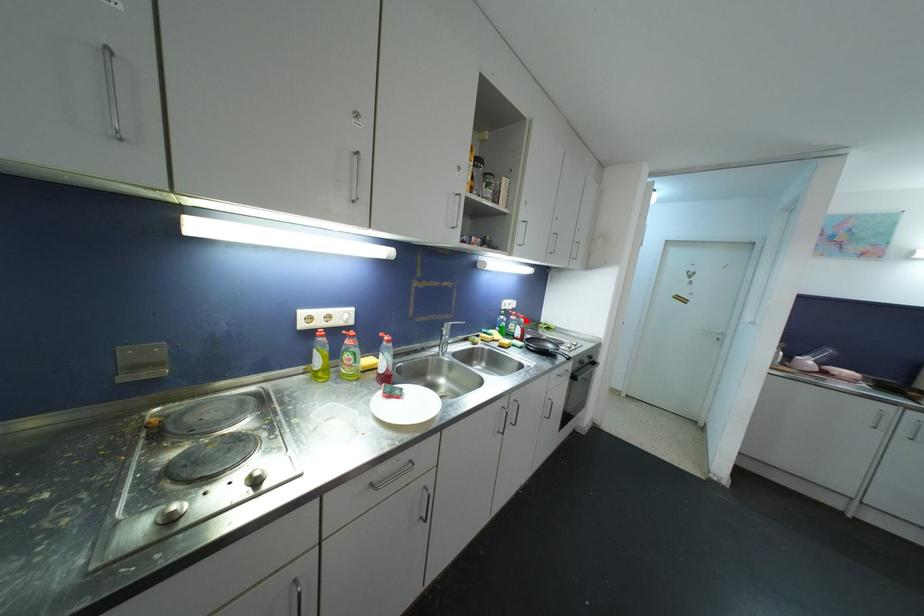
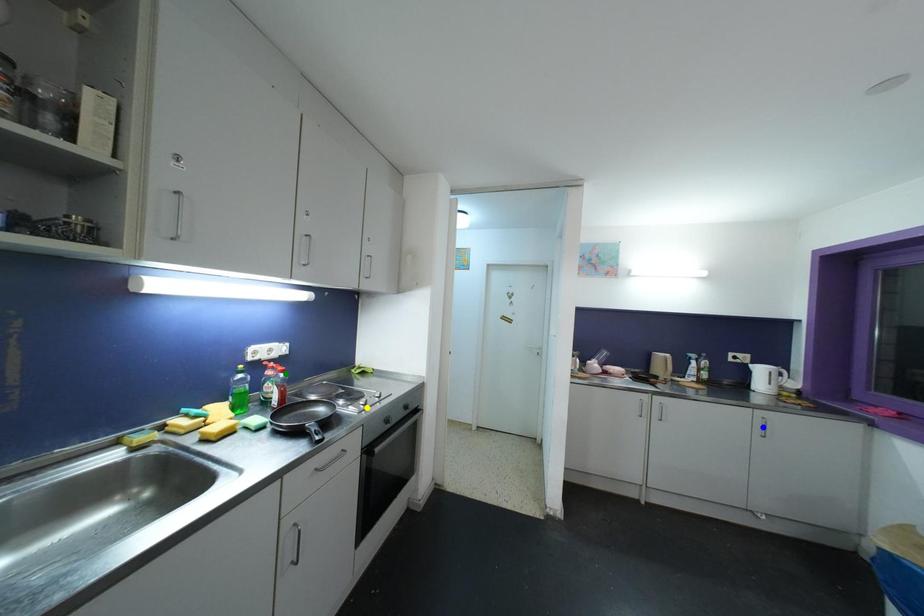
Question: I am providing you with two images of the same scene from different viewpoints. A red point is marked on the first image. You are given multiple points on the second image. Which point in image 2 is actually the same real-world point as the red point in image 1?

Choices:
 (A) blue point
 (B) yellow point
 (C) green point

Answer: (C)